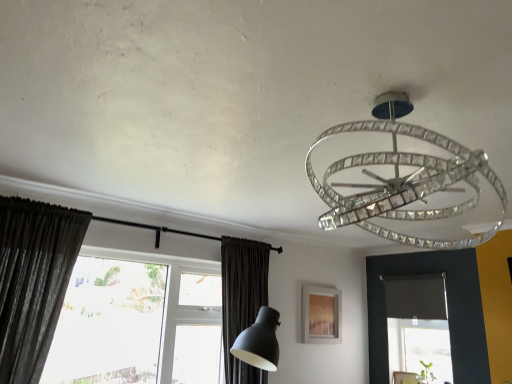
Question: Does dark gray textured curtain at left, the 2th curtain from the back, touch transparent glass window at lower left?

Choices:
 (A) no
 (B) yes

Answer: (A)

Question: Does dark gray textured curtain at left, the 1th curtain positioned from the left, have a lesser height compared to transparent glass window at lower left?

Choices:
 (A) yes
 (B) no

Answer: (A)

Question: Considering the relative sizes of dark gray textured curtain at left, the 1th curtain positioned from the left, and transparent glass window at lower left in the image provided, is dark gray textured curtain at left, the 1th curtain positioned from the left, taller than transparent glass window at lower left?

Choices:
 (A) no
 (B) yes

Answer: (A)

Question: Does dark gray textured curtain at left, the second curtain positioned from the right, turn towards transparent glass window at lower left?

Choices:
 (A) no
 (B) yes

Answer: (A)

Question: Can transparent glass window at lower left be found inside dark gray textured curtain at left, the 2th curtain from the back?

Choices:
 (A) no
 (B) yes

Answer: (A)

Question: Is transparent glass window at lower left bigger or smaller than clear crystal chandelier at upper center?

Choices:
 (A) big
 (B) small

Answer: (A)

Question: From their relative heights in the image, would you say transparent glass window at lower left is taller or shorter than clear crystal chandelier at upper center?

Choices:
 (A) short
 (B) tall

Answer: (B)

Question: From the image's perspective, is transparent glass window at lower left positioned above or below clear crystal chandelier at upper center?

Choices:
 (A) above
 (B) below

Answer: (B)

Question: Is transparent glass window at lower left wider or thinner than clear crystal chandelier at upper center?

Choices:
 (A) wide
 (B) thin

Answer: (A)

Question: Looking at their shapes, would you say dark gray textured curtain at left, the 1th curtain from the front, is wider or thinner than dark matte fabric curtain at lower center, which is counted as the second curtain, starting from the left?

Choices:
 (A) thin
 (B) wide

Answer: (A)

Question: In terms of size, does dark gray textured curtain at left, the 1th curtain from the front, appear bigger or smaller than dark matte fabric curtain at lower center, arranged as the 1th curtain when viewed from the right?

Choices:
 (A) small
 (B) big

Answer: (A)

Question: Visually, is dark gray textured curtain at left, the 2th curtain from the back, positioned to the left or to the right of dark matte fabric curtain at lower center, arranged as the second curtain when viewed from the front?

Choices:
 (A) right
 (B) left

Answer: (B)

Question: From a real-world perspective, is dark gray textured curtain at left, the second curtain positioned from the right, above or below dark matte fabric curtain at lower center, which is counted as the second curtain, starting from the left?

Choices:
 (A) above
 (B) below

Answer: (A)

Question: Is dark matte fabric curtain at lower center, arranged as the 1th curtain when viewed from the right, to the left or to the right of clear crystal chandelier at upper center in the image?

Choices:
 (A) right
 (B) left

Answer: (B)

Question: Is dark matte fabric curtain at lower center, arranged as the second curtain when viewed from the front, in front of or behind clear crystal chandelier at upper center in the image?

Choices:
 (A) front
 (B) behind

Answer: (B)